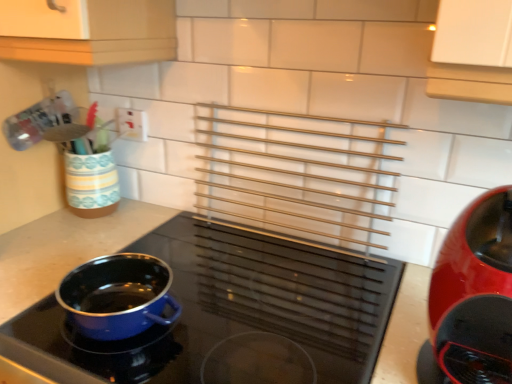
Question: From the image's perspective, would you say blue enamel pot at center-left, placed as the first kitchen appliance when sorted from left to right, is shown under glossy plastic coffee maker at right, positioned as the 1th kitchen appliance in right-to-left order?

Choices:
 (A) yes
 (B) no

Answer: (A)

Question: From the image's perspective, is blue enamel pot at center-left, which is the 2th kitchen appliance in right-to-left order, on top of glossy plastic coffee maker at right, positioned as the 1th kitchen appliance in right-to-left order?

Choices:
 (A) no
 (B) yes

Answer: (A)

Question: Can you confirm if blue enamel pot at center-left, which is the 2th kitchen appliance in right-to-left order, is wider than glossy plastic coffee maker at right, which ranks as the second kitchen appliance in left-to-right order?

Choices:
 (A) no
 (B) yes

Answer: (B)

Question: Can you confirm if blue enamel pot at center-left, placed as the first kitchen appliance when sorted from left to right, is taller than glossy plastic coffee maker at right, which ranks as the second kitchen appliance in left-to-right order?

Choices:
 (A) yes
 (B) no

Answer: (A)

Question: Is blue enamel pot at center-left, placed as the first kitchen appliance when sorted from left to right, oriented away from glossy plastic coffee maker at right, which ranks as the second kitchen appliance in left-to-right order?

Choices:
 (A) no
 (B) yes

Answer: (A)

Question: Does blue enamel pot at center-left, which is the 2th kitchen appliance in right-to-left order, contain glossy plastic coffee maker at right, positioned as the 1th kitchen appliance in right-to-left order?

Choices:
 (A) no
 (B) yes

Answer: (A)

Question: Does white plastic electric outlet at upper left turn towards blue enamel pot at center-left, placed as the first kitchen appliance when sorted from left to right?

Choices:
 (A) yes
 (B) no

Answer: (B)

Question: Is blue enamel pot at center-left, placed as the first kitchen appliance when sorted from left to right, located within white plastic electric outlet at upper left?

Choices:
 (A) no
 (B) yes

Answer: (A)

Question: From a real-world perspective, is white plastic electric outlet at upper left positioned under blue enamel pot at center-left, which is the 2th kitchen appliance in right-to-left order, based on gravity?

Choices:
 (A) yes
 (B) no

Answer: (B)

Question: From the image's perspective, does white plastic electric outlet at upper left appear lower than blue enamel pot at center-left, which is the 2th kitchen appliance in right-to-left order?

Choices:
 (A) no
 (B) yes

Answer: (A)

Question: Is white plastic electric outlet at upper left shorter than blue enamel pot at center-left, placed as the first kitchen appliance when sorted from left to right?

Choices:
 (A) no
 (B) yes

Answer: (B)

Question: Does white plastic electric outlet at upper left have a smaller size compared to blue enamel pot at center-left, placed as the first kitchen appliance when sorted from left to right?

Choices:
 (A) no
 (B) yes

Answer: (B)

Question: Is glossy plastic coffee maker at right, which ranks as the second kitchen appliance in left-to-right order, behind blue enamel pot at center-left, which is the 2th kitchen appliance in right-to-left order?

Choices:
 (A) no
 (B) yes

Answer: (B)